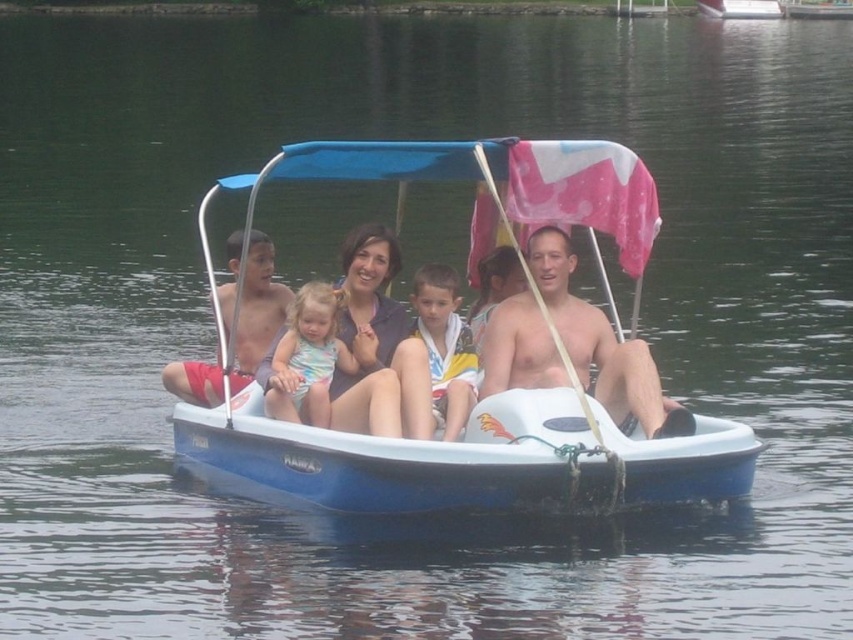
You are a photographer trying to capture a closeup shot of the matte red shorts at center and the pastel floral swimsuit at center in the boat scene. Which item should you zoom in on more to ensure both are in focus?

The matte red shorts at center has a larger size compared to pastel floral swimsuit at center, so you should zoom in more on the pastel floral swimsuit at center to ensure both are in focus.

You are on a boat with a group of people and need to hand a life jacket to the person wearing the matte red shorts at center. Which direction should you move to reach them relative to the pastel floral swimsuit at center?

The matte red shorts at center is to the left of the pastel floral swimsuit at center, so you should move to the left to reach them.

You are standing on the deck of the boat and want to reach both the point marked as point (415, 332) and the point marked as point (236, 259). Which point should you reach first to minimize the distance walked?

You should reach point (415, 332) first because it is closer to the viewer than point (236, 259).